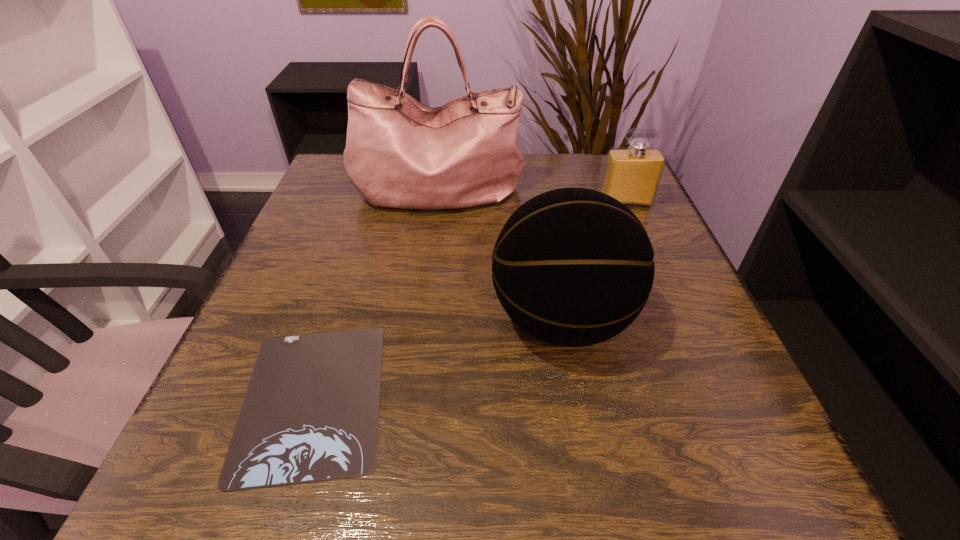
The height and width of the screenshot is (540, 960). Identify the location of vacant space at the left edge of the desktop. (334, 242).

Locate an element on the screen. free space at the right edge of the desktop is located at coordinates (648, 227).

You are a GUI agent. You are given a task and a screenshot of the screen. Output one action in this format:
    pyautogui.click(x=<x>, y=<y>)
    Task: Click on the vacant space at the far left corner of the desktop
    This screenshot has width=960, height=540.
    Given the screenshot: What is the action you would take?
    pyautogui.click(x=339, y=177)

Image resolution: width=960 pixels, height=540 pixels. I want to click on free point at the far right corner, so click(x=575, y=181).

In the image, there is a desktop. At what (x,y) coordinates should I click in order to perform the action: click on free region at the near right corner. Please return your answer as a coordinate pair (x, y). Looking at the image, I should click on (746, 481).

Find the location of a particular element. This screenshot has height=540, width=960. free point between the mousepad and the rightmost object is located at coordinates (468, 300).

Identify the location of vacant area that lies between the tallest object and the second shortest object. Image resolution: width=960 pixels, height=540 pixels. (532, 198).

At what (x,y) coordinates should I click in order to perform the action: click on free point between the tallest object and the third tallest object. Please return your answer as a coordinate pair (x, y). Image resolution: width=960 pixels, height=540 pixels. Looking at the image, I should click on (532, 198).

Where is `vacant space in between the handbag and the mousepad`? vacant space in between the handbag and the mousepad is located at coordinates (375, 295).

The width and height of the screenshot is (960, 540). What are the coordinates of `free space between the tallest object and the third tallest object` in the screenshot? It's located at (532, 198).